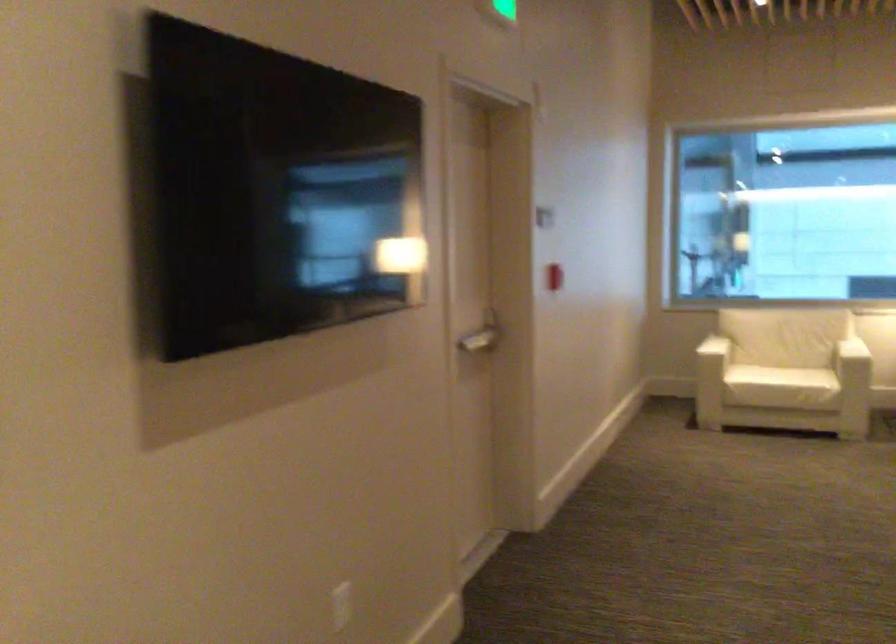
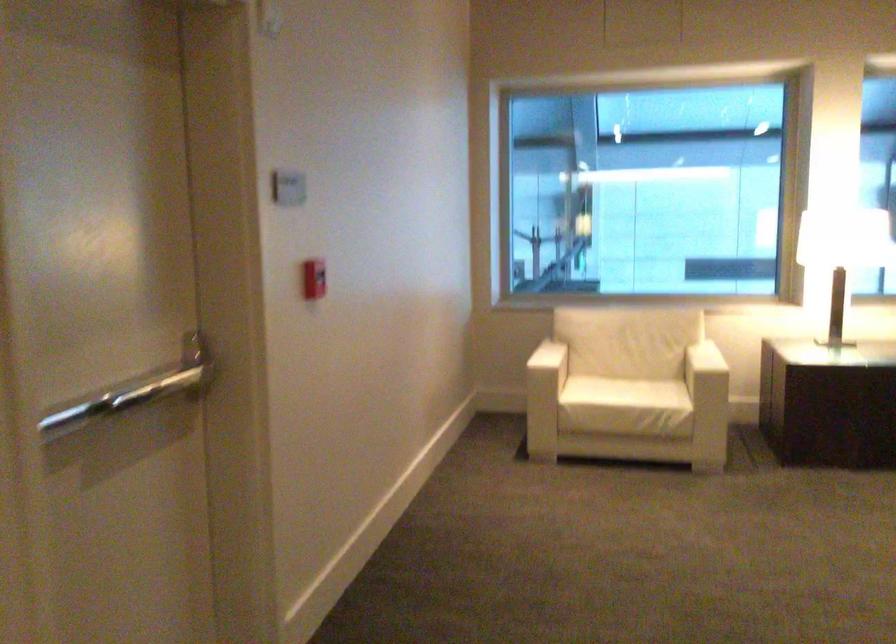
Locate, in the second image, the point that corresponds to [714,348] in the first image.

(536, 377)